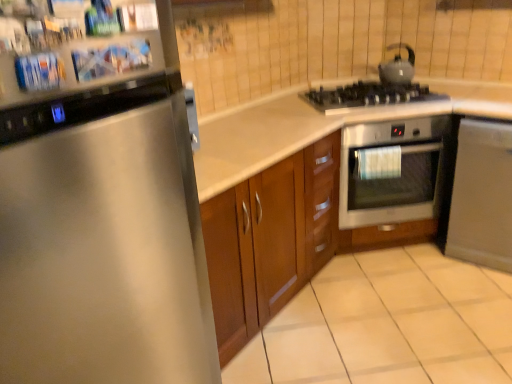
Question: Considering the relative positions of stainless steel oven at center-right and white glossy countertop at center in the image provided, is stainless steel oven at center-right behind white glossy countertop at center?

Choices:
 (A) no
 (B) yes

Answer: (B)

Question: Considering the relative positions of stainless steel oven at center-right and white glossy countertop at center in the image provided, is stainless steel oven at center-right in front of white glossy countertop at center?

Choices:
 (A) no
 (B) yes

Answer: (A)

Question: Is stainless steel oven at center-right not inside white glossy countertop at center?

Choices:
 (A) no
 (B) yes

Answer: (A)

Question: From the image's perspective, is stainless steel oven at center-right over white glossy countertop at center?

Choices:
 (A) no
 (B) yes

Answer: (B)

Question: Is stainless steel oven at center-right to the left of white glossy countertop at center from the viewer's perspective?

Choices:
 (A) no
 (B) yes

Answer: (A)

Question: From the image's perspective, is stainless steel oven at center-right located beneath white glossy countertop at center?

Choices:
 (A) yes
 (B) no

Answer: (B)

Question: Can you confirm if stainless steel oven at center-right is positioned to the right of black matte gas stove at upper right?

Choices:
 (A) no
 (B) yes

Answer: (B)

Question: Does stainless steel oven at center-right have a greater height compared to black matte gas stove at upper right?

Choices:
 (A) yes
 (B) no

Answer: (A)

Question: From a real-world perspective, is stainless steel oven at center-right positioned over black matte gas stove at upper right based on gravity?

Choices:
 (A) yes
 (B) no

Answer: (B)

Question: From the image's perspective, would you say stainless steel oven at center-right is positioned over black matte gas stove at upper right?

Choices:
 (A) yes
 (B) no

Answer: (B)

Question: From the image's perspective, would you say stainless steel oven at center-right is shown under black matte gas stove at upper right?

Choices:
 (A) yes
 (B) no

Answer: (A)

Question: Is stainless steel oven at center-right facing away from black matte gas stove at upper right?

Choices:
 (A) no
 (B) yes

Answer: (A)

Question: Is black matte gas stove at upper right further to the viewer compared to satin silver dishwasher at lower right?

Choices:
 (A) yes
 (B) no

Answer: (A)